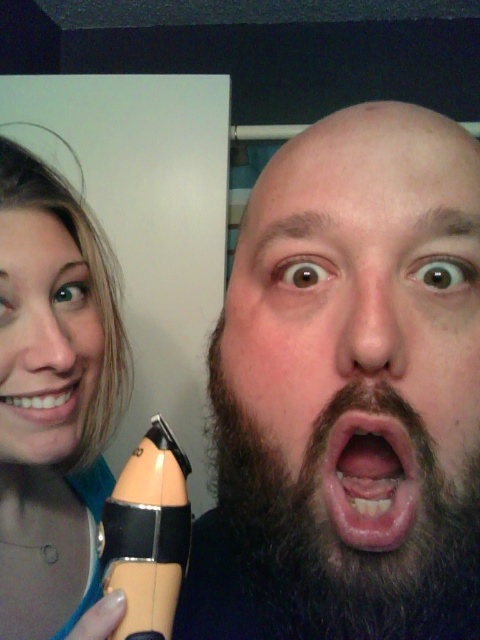
You are a photographer setting up a portrait session. You have a dark brown beard at center and a matte black foundation at left. Which object should you focus on first if you want to capture both in the frame without moving the camera?

The dark brown beard at center is smaller than the matte black foundation at left, so you should focus on the matte black foundation at left first since it is larger and more prominent in the scene.

You are a photographer setting up for a closeup shot. You need to ensure that both the matte black foundation at left and the white glossy teeth at center are clearly visible in the frame. Considering their heights, which object should you adjust your focus on first to ensure proper exposure?

The matte black foundation at left has a greater height compared to the white glossy teeth at center, so you should focus on the matte black foundation at left first to ensure proper exposure.